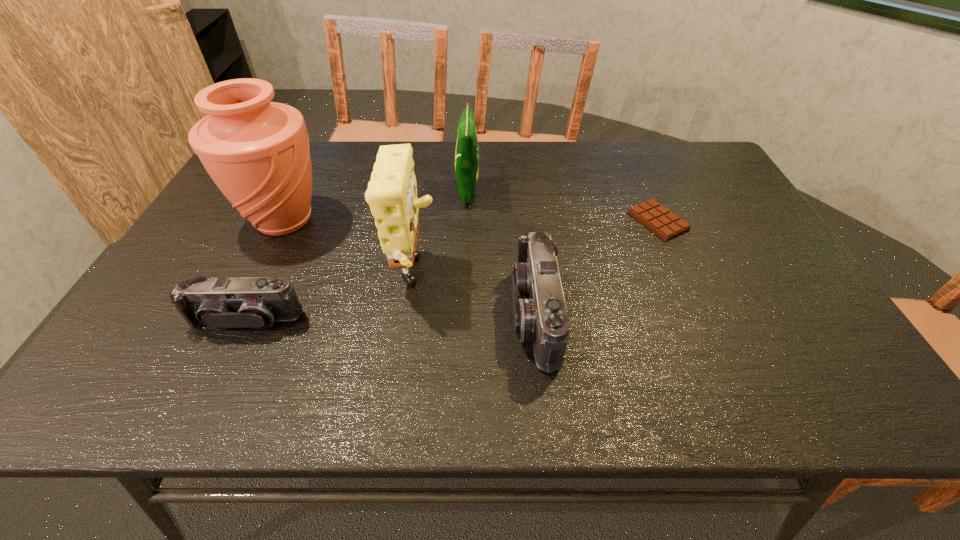
This screenshot has height=540, width=960. I want to click on vacant space that satisfies the following two spatial constraints: 1. on the back side of the shortest object; 2. on the front-facing side of the third tallest object, so click(x=645, y=193).

Locate an element on the screen. The image size is (960, 540). free location that satisfies the following two spatial constraints: 1. on the front-facing side of the fourth object from left to right; 2. on the front side of the tallest object is located at coordinates (467, 220).